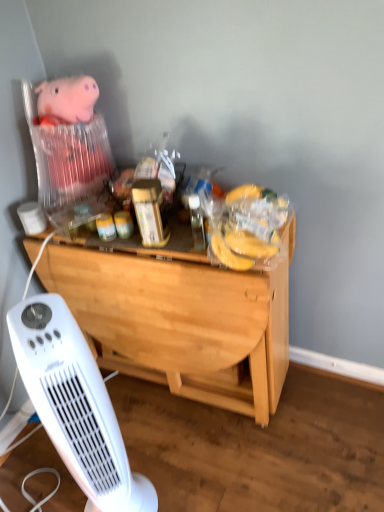
Where is `vacant area on the back side of white plastic heater at lower left`? This screenshot has height=512, width=384. vacant area on the back side of white plastic heater at lower left is located at coordinates (147, 441).